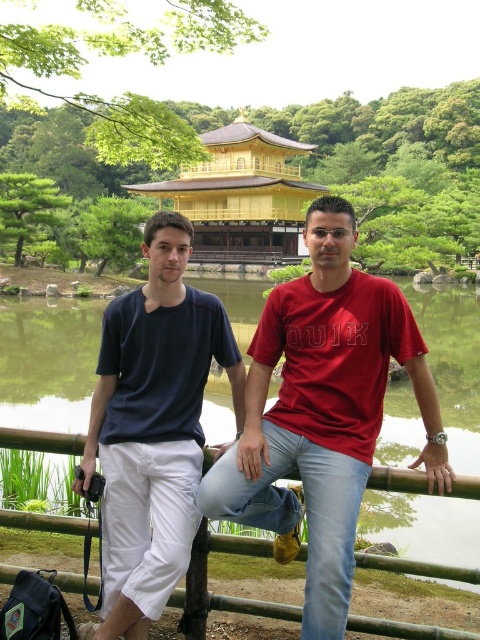
Does matte red t-shirt at center have a greater width compared to dark blue cotton t-shirt at center?

Indeed, matte red t-shirt at center has a greater width compared to dark blue cotton t-shirt at center.

Where is `matte red t-shirt at center`? Image resolution: width=480 pixels, height=640 pixels. matte red t-shirt at center is located at coordinates (323, 412).

Can you confirm if dark blue cotton t-shirt at center is taller than gold/golden/temple at center?

No.

Is point (171, 428) positioned before point (180, 209)?

Yes, point (171, 428) is closer to viewer.

Where is `dark blue cotton t-shirt at center`? dark blue cotton t-shirt at center is located at coordinates (153, 428).

Is point (361, 300) more distant than point (240, 236)?

No, it is not.

Identify the location of matte red t-shirt at center. (323, 412).

Image resolution: width=480 pixels, height=640 pixels. What do you see at coordinates (323, 412) in the screenshot?
I see `matte red t-shirt at center` at bounding box center [323, 412].

Image resolution: width=480 pixels, height=640 pixels. What are the coordinates of `matte red t-shirt at center` in the screenshot? It's located at (323, 412).